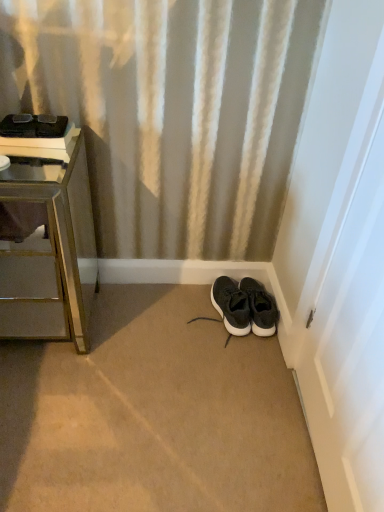
The width and height of the screenshot is (384, 512). Find the location of `vacant space that is in between brushed metal nightstand at left and black suede sneakers at lower right, which is counted as the 1th footwear, starting from the right`. vacant space that is in between brushed metal nightstand at left and black suede sneakers at lower right, which is counted as the 1th footwear, starting from the right is located at coordinates (154, 322).